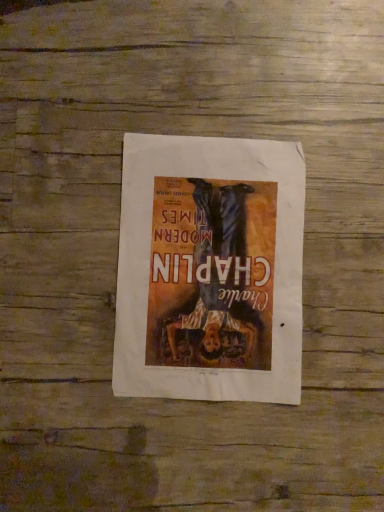
Locate an element on the screen. The width and height of the screenshot is (384, 512). blank space situated above matte paper poster at center (from a real-world perspective) is located at coordinates (208, 267).